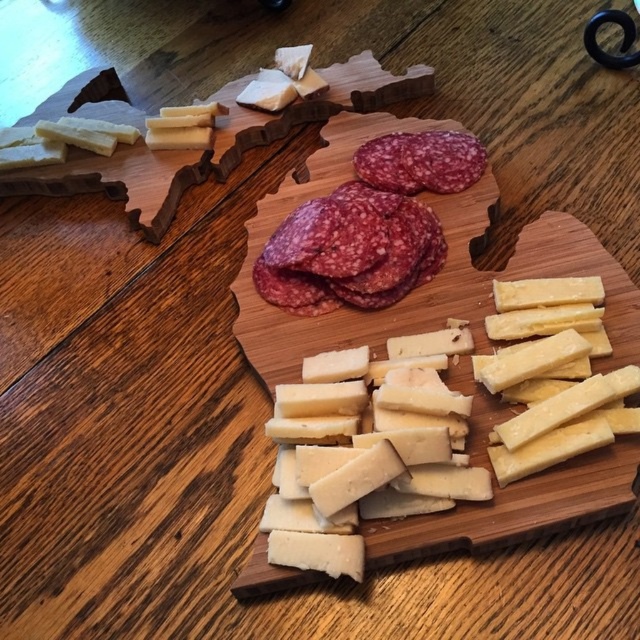
Does yellow cheese at center appear on the right side of purple marbled salami at center?

Correct, you'll find yellow cheese at center to the right of purple marbled salami at center.

Does yellow cheese at center have a greater width compared to purple marbled salami at center?

Correct, the width of yellow cheese at center exceeds that of purple marbled salami at center.

Is point (516, 371) positioned behind point (301, 234)?

No, it is in front of (301, 234).

Locate an element on the screen. The width and height of the screenshot is (640, 640). yellow cheese at center is located at coordinates (365, 448).